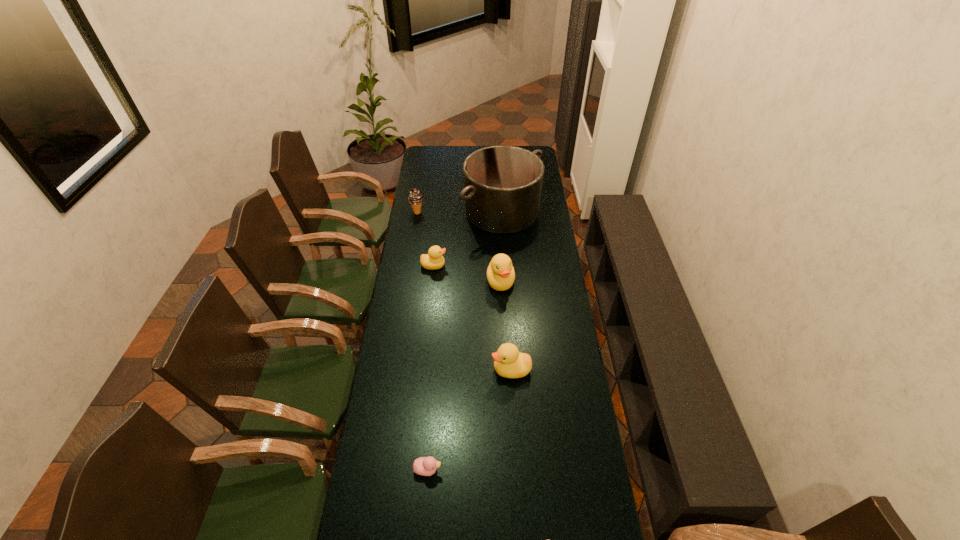
You are a GUI agent. You are given a task and a screenshot of the screen. Output one action in this format:
    pyautogui.click(x=<x>, y=<y>)
    Task: Click on the vacant space at the left edge
    This screenshot has width=960, height=540.
    Given the screenshot: What is the action you would take?
    pyautogui.click(x=435, y=209)

Where is `vacant space at the right edge of the desktop`? This screenshot has width=960, height=540. vacant space at the right edge of the desktop is located at coordinates (554, 289).

At what (x,y) coordinates should I click in order to perform the action: click on vacant space at the far left corner of the desktop. Please return your answer as a coordinate pair (x, y). The width and height of the screenshot is (960, 540). Looking at the image, I should click on (431, 153).

Locate an element on the screen. The image size is (960, 540). free space between the biggest yellow duckling and the farther pink duckling is located at coordinates (464, 375).

Identify the location of vacant area between the second tallest duckling and the smallest yellow duckling. The width and height of the screenshot is (960, 540). (472, 318).

Find the location of `unoccupied position between the second biggest yellow duckling and the leftmost yellow duckling`. unoccupied position between the second biggest yellow duckling and the leftmost yellow duckling is located at coordinates (472, 318).

The image size is (960, 540). Find the location of `empty location between the leftmost object and the smallest yellow duckling`. empty location between the leftmost object and the smallest yellow duckling is located at coordinates (425, 239).

Where is `free point between the chocolate icecream and the second biggest yellow duckling`? This screenshot has width=960, height=540. free point between the chocolate icecream and the second biggest yellow duckling is located at coordinates (464, 291).

This screenshot has width=960, height=540. Identify the location of unoccupied position between the leftmost yellow duckling and the fifth farthest object. (472, 318).

You are a GUI agent. You are given a task and a screenshot of the screen. Output one action in this format:
    pyautogui.click(x=<x>, y=<y>)
    Task: Click on the sixth closest object to the chocolate icecream
    The width and height of the screenshot is (960, 540).
    Given the screenshot: What is the action you would take?
    pyautogui.click(x=548, y=539)